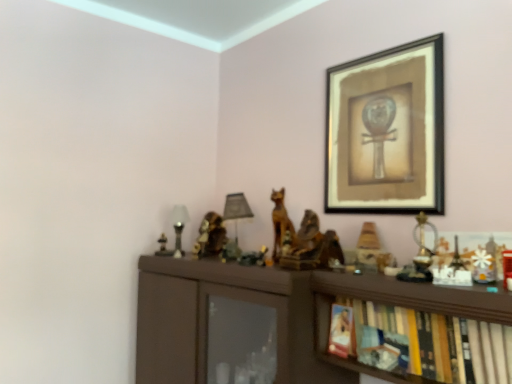
Question: Is wooden figurine at center-right, placed as the second toy when sorted from back to front, in front of or behind wooden statue at center in the image?

Choices:
 (A) front
 (B) behind

Answer: (A)

Question: Considering the positions of point (367, 256) and point (286, 226), is point (367, 256) closer or farther from the camera than point (286, 226)?

Choices:
 (A) farther
 (B) closer

Answer: (B)

Question: Which of these objects is positioned closest to the black matte picture frame at upper right?

Choices:
 (A) wooden figurine at center-right, the third toy in the front-to-back sequence
 (B) metallic gold statue at right, which is the third toy from back to front
 (C) wooden statue at center
 (D) matte glass table lamp at left, which ranks as the 2th table lamp in right-to-left order
 (E) matte black table lamp at center, the 1th table lamp viewed from the right

Answer: (B)

Question: Based on their relative distances, which object is nearer to the matte black table lamp at center, the 1th table lamp viewed from the right?

Choices:
 (A) white plastic snowflake at upper right, which is the 4th toy from left to right
 (B) wooden bookshelf at lower right
 (C) black matte picture frame at upper right
 (D) matte glass table lamp at left, which ranks as the 1th table lamp in left-to-right order
 (E) metallic gold statue at right, arranged as the 3th toy when viewed from the left

Answer: (D)